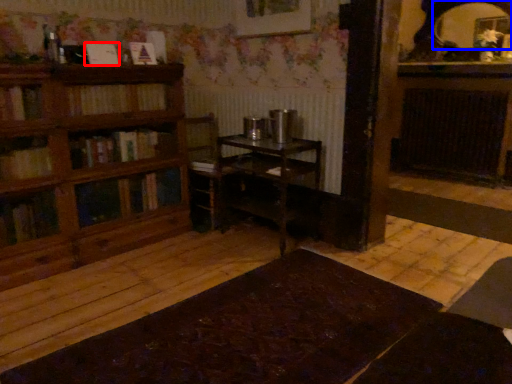
Question: Which of the following is the farthest to the observer, book (highlighted by a red box) or mirror (highlighted by a blue box)?

Choices:
 (A) book
 (B) mirror

Answer: (B)